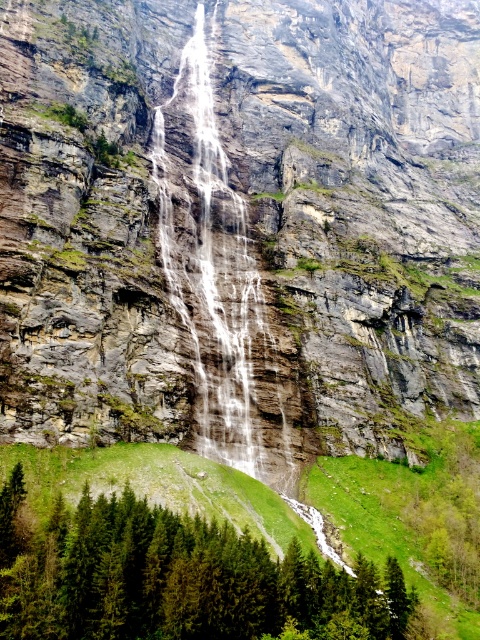
Question: Which of the following is the closest to the observer?

Choices:
 (A) green matte tree at lower left
 (B) rocky cliff face at center
 (C) clear water at center

Answer: (A)

Question: Is green matte tree at lower left closer to camera compared to clear water at center?

Choices:
 (A) yes
 (B) no

Answer: (A)

Question: Which point appears farthest from the camera in this image?

Choices:
 (A) (247, 630)
 (B) (205, 305)

Answer: (B)

Question: Does green matte tree at lower left appear on the right side of clear water at center?

Choices:
 (A) yes
 (B) no

Answer: (A)

Question: Which object is closer to the camera taking this photo?

Choices:
 (A) rocky cliff face at center
 (B) clear water at center
 (C) green matte tree at lower left

Answer: (C)

Question: Is green matte tree at lower left above clear water at center?

Choices:
 (A) yes
 (B) no

Answer: (B)